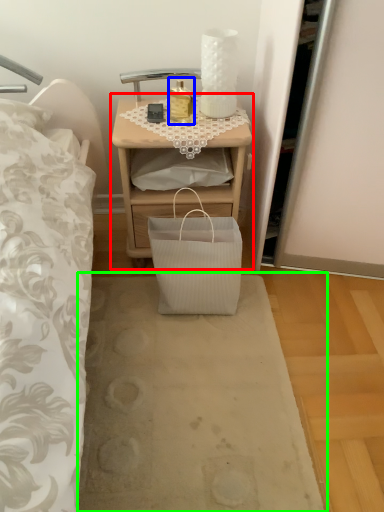
Question: Which is nearer to the nightstand (highlighted by a red box)? bottle (highlighted by a blue box) or plain (highlighted by a green box).

Choices:
 (A) bottle
 (B) plain

Answer: (A)